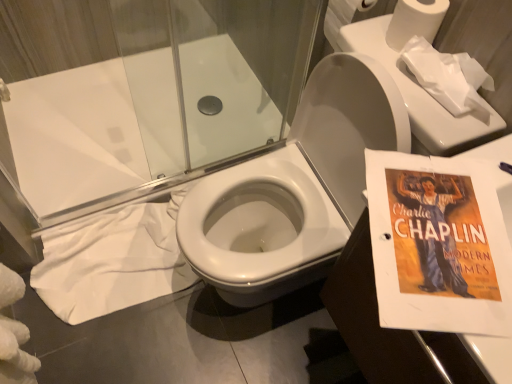
Locate an element on the screen. The width and height of the screenshot is (512, 384). empty space that is ontop of matte paper charlie chaplin poster at right (from a real-world perspective) is located at coordinates (471, 215).